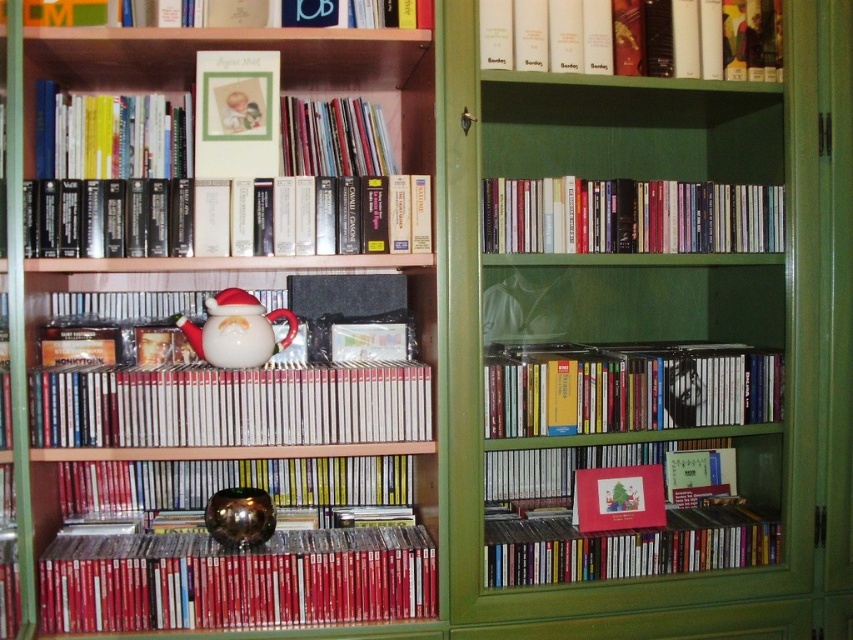
Question: Observing the image, what is the correct spatial positioning of hardcover book at center in reference to hardcover book at upper center?

Choices:
 (A) left
 (B) right

Answer: (B)

Question: Is hardcover book at center behind matte plastic books at center?

Choices:
 (A) no
 (B) yes

Answer: (B)

Question: Which point is closer to the camera taking this photo?

Choices:
 (A) (292, 97)
 (B) (529, 579)
 (C) (605, 365)

Answer: (B)

Question: Is hardcover book at upper right to the left of hardcover book at upper center from the viewer's perspective?

Choices:
 (A) no
 (B) yes

Answer: (A)

Question: Which point appears closest to the camera in this image?

Choices:
 (A) (80, 10)
 (B) (497, 397)

Answer: (A)

Question: Among these objects, which one is farthest from the camera?

Choices:
 (A) hardcover book at center
 (B) metallic gold bowl at center
 (C) hardcover books at upper center

Answer: (C)